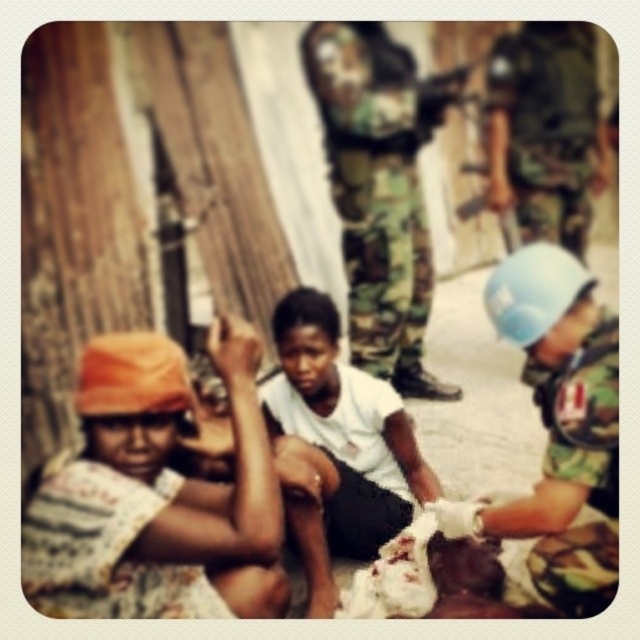
Does camouflage uniform at right have a greater width compared to woven fabric hat at lower left?

No, camouflage uniform at right is not wider than woven fabric hat at lower left.

Is camouflage uniform at right behind woven fabric hat at lower left?

No.

At what (x,y) coordinates should I click in order to perform the action: click on camouflage uniform at right. Please return your answer as a coordinate pair (x, y). Looking at the image, I should click on (545, 131).

The width and height of the screenshot is (640, 640). Identify the location of camouflage uniform at right. (545, 131).

In the scene shown: Who is taller, camouflage uniform at center or camouflage uniform at lower right?

With more height is camouflage uniform at lower right.

Between point (372, 268) and point (548, 584), which one is positioned behind?

Positioned behind is point (372, 268).

Does point (404, 273) come closer to viewer compared to point (556, 452)?

No, it is behind (556, 452).

Image resolution: width=640 pixels, height=640 pixels. I want to click on camouflage uniform at center, so click(380, 189).

Is camouflage uniform at center to the right of woven fabric hat at lower left from the viewer's perspective?

Yes, camouflage uniform at center is to the right of woven fabric hat at lower left.

Who is positioned more to the left, camouflage uniform at center or woven fabric hat at lower left?

From the viewer's perspective, woven fabric hat at lower left appears more on the left side.

Does point (410, 156) lie behind point (52, 464)?

No, (410, 156) is closer to viewer.

Where is `camouflage uniform at center`? camouflage uniform at center is located at coordinates (380, 189).